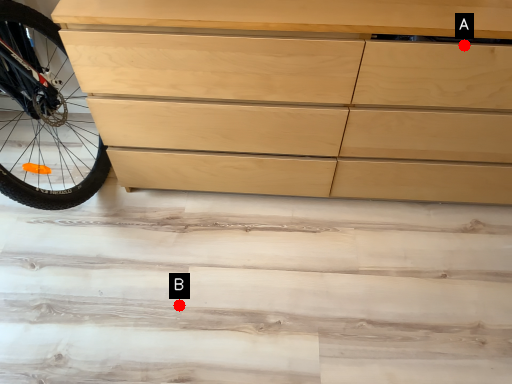
Question: Two points are circled on the image, labeled by A and B beside each circle. Which point appears farthest from the camera in this image?

Choices:
 (A) A is further
 (B) B is further

Answer: (B)